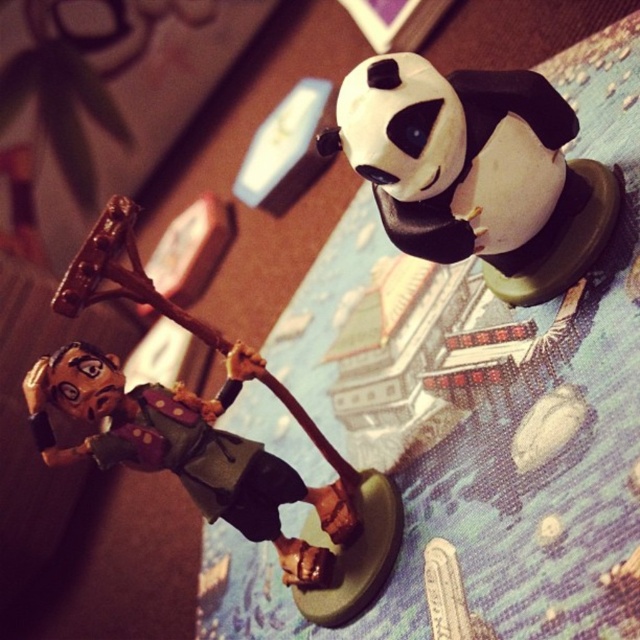
Which is more to the left, white matte panda at upper right or matte brown wood figure at center?

matte brown wood figure at center is more to the left.

Is white matte panda at upper right to the left of matte brown wood figure at center from the viewer's perspective?

In fact, white matte panda at upper right is to the right of matte brown wood figure at center.

Which is behind, point (371, 129) or point (179, 465)?

Positioned behind is point (179, 465).

You are a GUI agent. You are given a task and a screenshot of the screen. Output one action in this format:
    pyautogui.click(x=<x>, y=<y>)
    Task: Click on the white matte panda at upper right
    
    Given the screenshot: What is the action you would take?
    pyautogui.click(x=476, y=170)